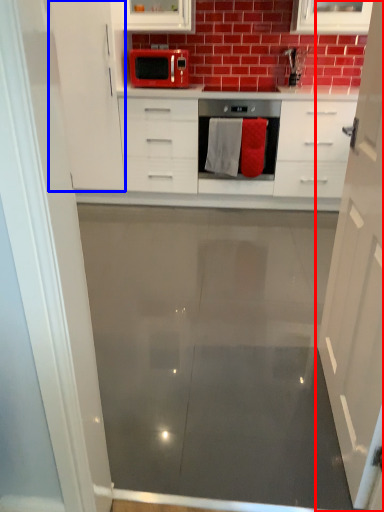
Question: Which object appears closest to the camera in this image, cabinetry (highlighted by a red box) or cabinetry (highlighted by a blue box)?

Choices:
 (A) cabinetry
 (B) cabinetry

Answer: (A)